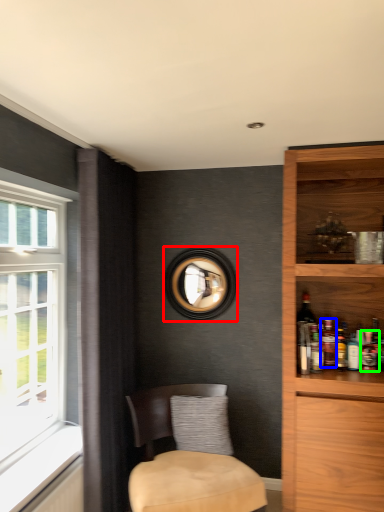
Question: Based on their relative distances, which object is nearer to picture frame (highlighted by a red box)? Choose from beverage (highlighted by a blue box) and beverage (highlighted by a green box).

Choices:
 (A) beverage
 (B) beverage

Answer: (A)